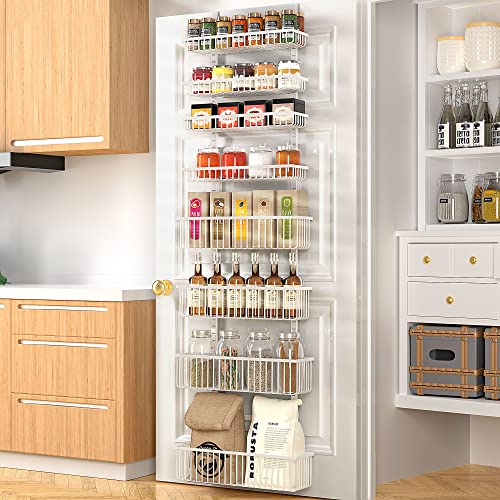
Where is `silver lids on 4th shelf`? silver lids on 4th shelf is located at coordinates (208, 150), (233, 148), (261, 147), (286, 146).